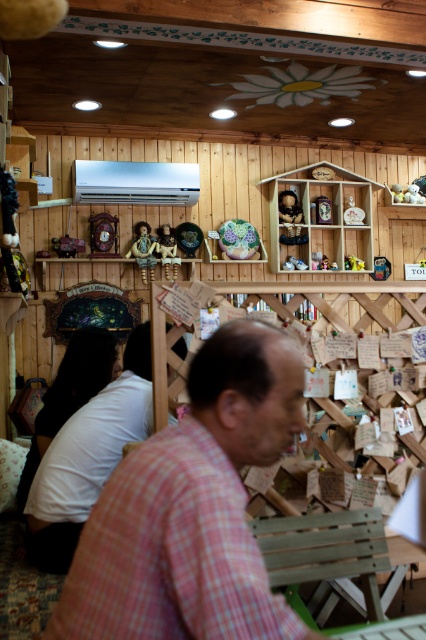
Between pink checkered shirt at center and wooden shelf at upper center, which one is positioned higher?

Positioned higher is wooden shelf at upper center.

What do you see at coordinates (192, 509) in the screenshot?
I see `pink checkered shirt at center` at bounding box center [192, 509].

Image resolution: width=426 pixels, height=640 pixels. What do you see at coordinates (192, 509) in the screenshot? I see `pink checkered shirt at center` at bounding box center [192, 509].

Locate an element on the screen. The height and width of the screenshot is (640, 426). pink checkered shirt at center is located at coordinates (192, 509).

Can you confirm if white matte shirt at left is taller than matte plastic figurine at upper center?

Yes, white matte shirt at left is taller than matte plastic figurine at upper center.

What do you see at coordinates (69, 394) in the screenshot? I see `white matte shirt at left` at bounding box center [69, 394].

Find the location of a particular element. The width and height of the screenshot is (426, 640). white matte shirt at left is located at coordinates (69, 394).

Is pink checkered shirt at center behind wooden figurine at center?

No, it is in front of wooden figurine at center.

In order to click on pink checkered shirt at center in this screenshot , I will do `click(192, 509)`.

Is point (221, 502) positioned behind point (351, 253)?

No, it is not.

I want to click on pink checkered shirt at center, so click(x=192, y=509).